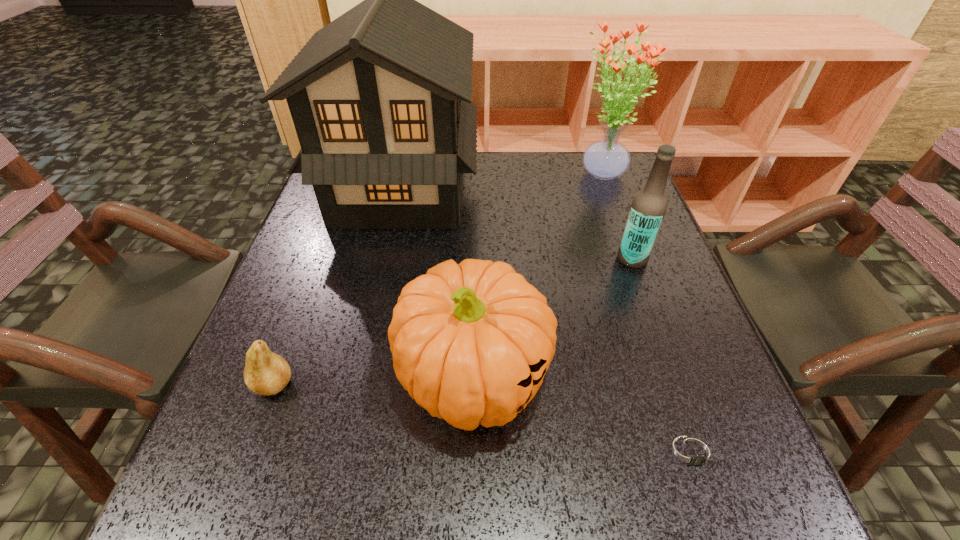
Find the location of a particular element. The width and height of the screenshot is (960, 540). vacant space situated 0.160m on the label of the fourth nearest object is located at coordinates (545, 259).

The width and height of the screenshot is (960, 540). I want to click on vacant area situated 0.080m on the surface of the pumpkin, so click(x=472, y=511).

Where is `vacant space located on the back of the pear`? vacant space located on the back of the pear is located at coordinates (319, 267).

Where is `dollhouse that is at the far edge`? The height and width of the screenshot is (540, 960). dollhouse that is at the far edge is located at coordinates (380, 98).

Image resolution: width=960 pixels, height=540 pixels. I want to click on flower arrangement located in the far edge section of the desktop, so click(606, 159).

Identify the location of object that is at the near edge. (691, 452).

The width and height of the screenshot is (960, 540). What are the coordinates of `dollhouse that is at the left edge` in the screenshot? It's located at (380, 98).

The image size is (960, 540). What are the coordinates of `pear that is at the left edge` in the screenshot? It's located at (266, 373).

I want to click on flower arrangement at the right edge, so click(606, 159).

Identify the location of beer bottle at the right edge. Image resolution: width=960 pixels, height=540 pixels. (648, 208).